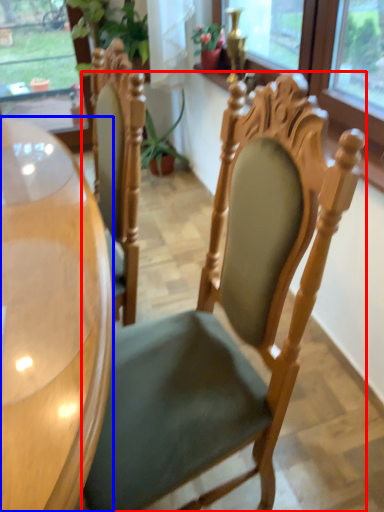
Question: Which object is closer to the camera taking this photo, chair (highlighted by a red box) or desk (highlighted by a blue box)?

Choices:
 (A) chair
 (B) desk

Answer: (B)